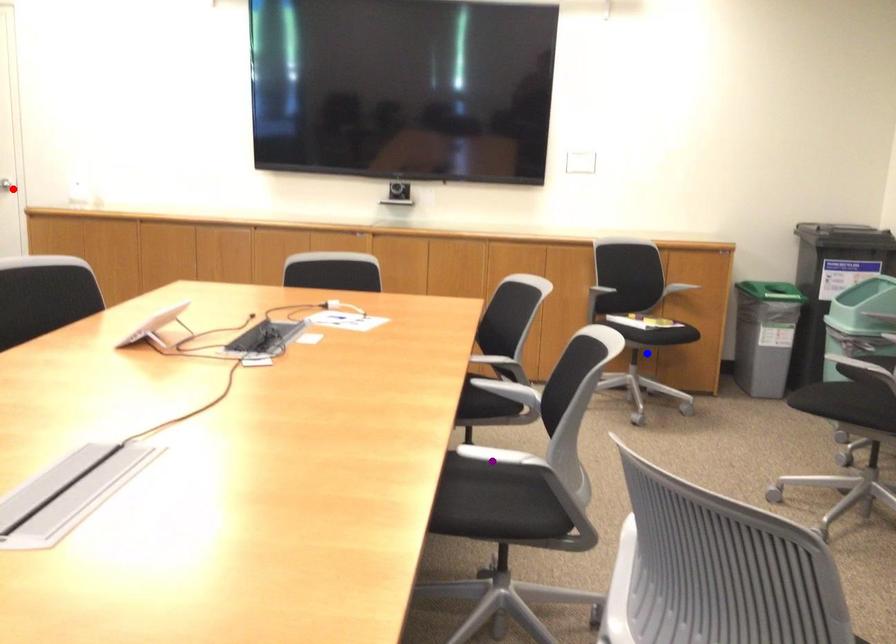
Order these from farthest to nearest:
- purple point
- red point
- blue point

1. red point
2. blue point
3. purple point